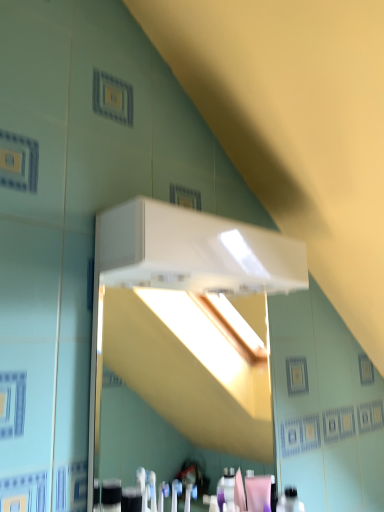
I want to click on white glossy mirror at upper center, so click(186, 311).

This screenshot has width=384, height=512. What do you see at coordinates (186, 311) in the screenshot? I see `white glossy mirror at upper center` at bounding box center [186, 311].

Find the location of `white glossy mirror at upper center`. white glossy mirror at upper center is located at coordinates (186, 311).